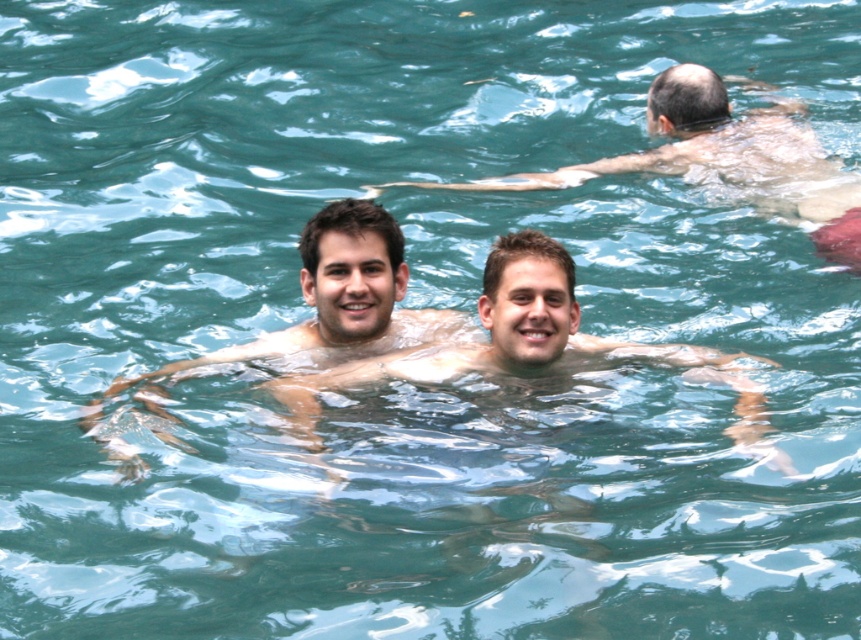
Which is behind, point (407, 376) or point (655, 154)?

Positioned behind is point (655, 154).

Between point (518, 308) and point (688, 122), which one is positioned in front?

Point (518, 308) is in front.

At what (x,y) coordinates should I click in order to perform the action: click on smooth skin at center. Please return your answer as a coordinate pair (x, y). The image size is (861, 640). Looking at the image, I should click on (527, 346).

Is smooth skin man at center behind smooth skin at center?

Yes, smooth skin man at center is further from the viewer.

Consider the image. Between smooth skin man at center and smooth skin at center, which one has more height?

Standing taller between the two is smooth skin man at center.

Which is behind, point (395, 221) or point (307, 378)?

The point (395, 221) is more distant.

The width and height of the screenshot is (861, 640). In order to click on smooth skin man at center in this screenshot , I will do `click(301, 323)`.

Is smooth skin man at center wider than smooth skin man at upper center?

In fact, smooth skin man at center might be narrower than smooth skin man at upper center.

Between smooth skin man at center and smooth skin man at upper center, which one has less height?

smooth skin man at center is shorter.

The image size is (861, 640). Describe the element at coordinates (301, 323) in the screenshot. I see `smooth skin man at center` at that location.

Locate an element on the screen. The height and width of the screenshot is (640, 861). smooth skin man at center is located at coordinates (301, 323).